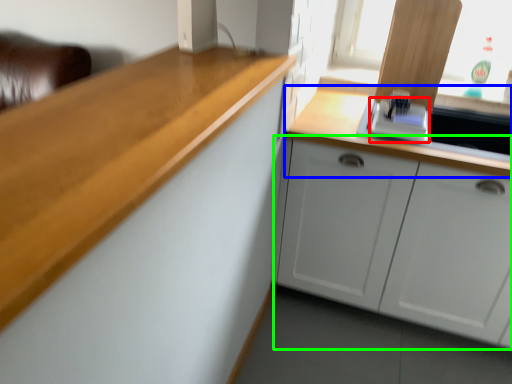
Question: Considering the real-world distances, which object is farthest from appliance (highlighted by a red box)? countertop (highlighted by a blue box) or cabinetry (highlighted by a green box)?

Choices:
 (A) countertop
 (B) cabinetry

Answer: (B)